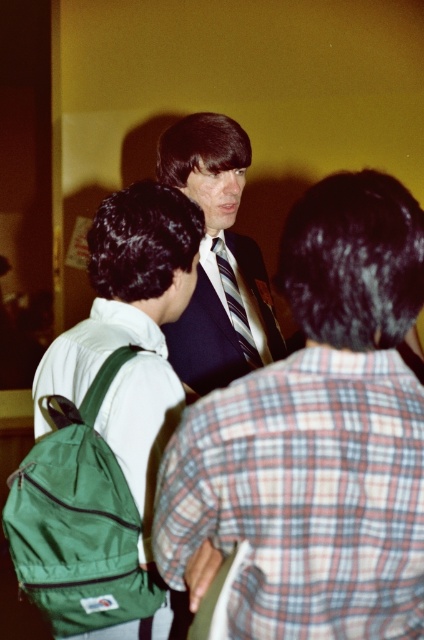
You are at a social event and need to locate the green fabric backpack at left. Where should you look relative to the dark blue suit at center?

The dark blue suit at center is above the green fabric backpack at left, so you should look below the dark blue suit at center to find the green fabric backpack at left.

You are at a social event and notice two items at the center of the scene. The green fabric backpack at center and the dark blue fabric business suit at center. Which item is taller?

The green fabric backpack at center is much taller than the dark blue fabric business suit at center.

You are organizing a photo shoot and need to ensure that the dark blue suit at center and the green fabric backpack at center are both visible in the frame. Based on their sizes, which object would you need to position closer to the camera to maintain visibility?

The dark blue suit at center has a lesser height compared to the green fabric backpack at center. To ensure both are visible, position the dark blue suit at center closer to the camera since it is smaller in height and needs to be magnified slightly to match the backpack in the frame.